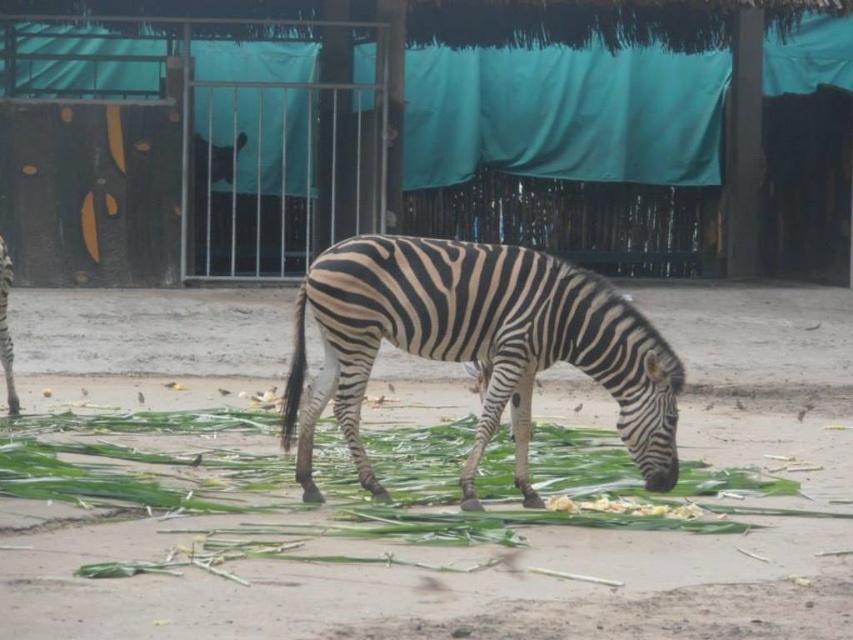
You are a zookeeper observing the black and white striped zebra at center and the green leafy grass at center. Which object is taller?

The black and white striped zebra at center is taller than the green leafy grass at center.

You are a zookeeper observing the enclosure. The zebra is currently eating. Where is the green leafy grass at center located in relation to the black and white striped zebra at center?

The green leafy grass at center is below the black and white striped zebra at center, which is why the zebra is able to graze on it.

You are standing in the enclosure with the zebra and want to place a small treat between the two points marked as point (508, 484) and point (659, 513). Which point is closer to you so you can reach it first?

Point (508, 484) is closer to you than point (659, 513), so you can reach it first.